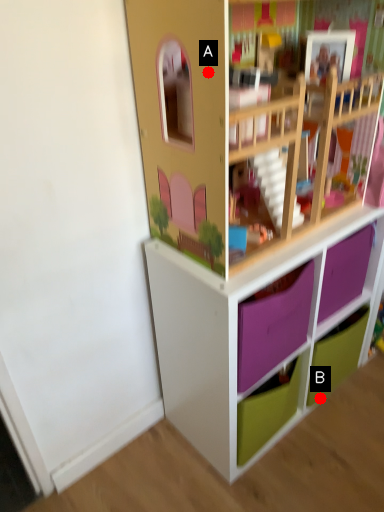
Question: Two points are circled on the image, labeled by A and B beside each circle. Which point appears farthest from the camera in this image?

Choices:
 (A) A is further
 (B) B is further

Answer: (B)